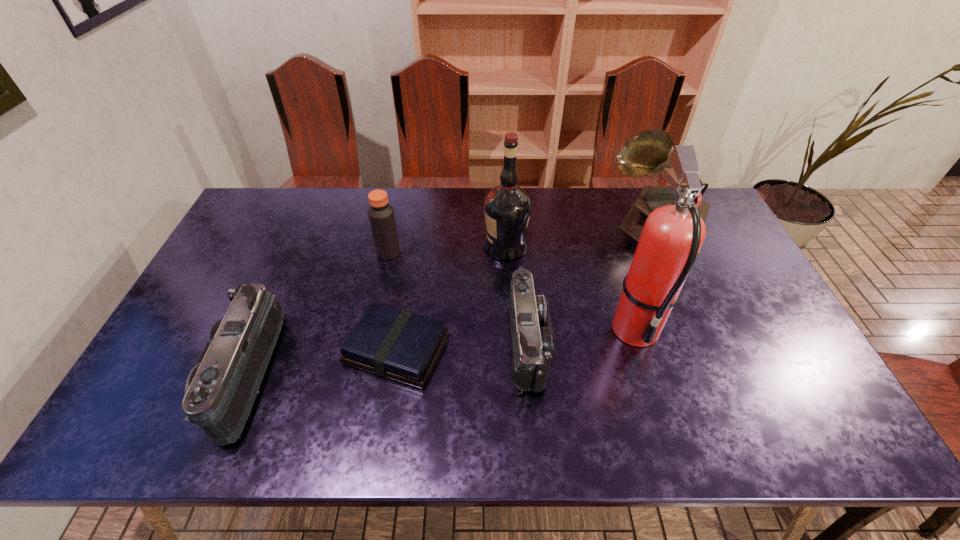
At what (x,y) coordinates should I click in order to perform the action: click on the third shortest object. Please return your answer as a coordinate pair (x, y). Image resolution: width=960 pixels, height=540 pixels. Looking at the image, I should click on (220, 390).

Locate an element on the screen. This screenshot has width=960, height=540. the left camcorder is located at coordinates (220, 390).

Where is `the shorter camcorder`? The width and height of the screenshot is (960, 540). the shorter camcorder is located at coordinates (532, 337).

You are a GUI agent. You are given a task and a screenshot of the screen. Output one action in this format:
    pyautogui.click(x=<x>, y=<y>)
    Task: Click on the sixth tallest object
    
    Given the screenshot: What is the action you would take?
    pyautogui.click(x=532, y=337)

Where is `liquor`? Image resolution: width=960 pixels, height=540 pixels. liquor is located at coordinates (507, 207).

Locate an element on the screen. the third tallest object is located at coordinates (648, 153).

The width and height of the screenshot is (960, 540). In order to click on the fourth shortest object in this screenshot , I will do `click(381, 215)`.

At what (x,y) coordinates should I click in order to perform the action: click on book. Please return your answer as a coordinate pair (x, y). This screenshot has width=960, height=540. Looking at the image, I should click on (393, 343).

What are the coordinates of `fire extinguisher` in the screenshot? It's located at point(672,236).

Image resolution: width=960 pixels, height=540 pixels. In order to click on free location located 0.120m on the front-facing side of the taller camcorder in this screenshot , I will do `click(173, 375)`.